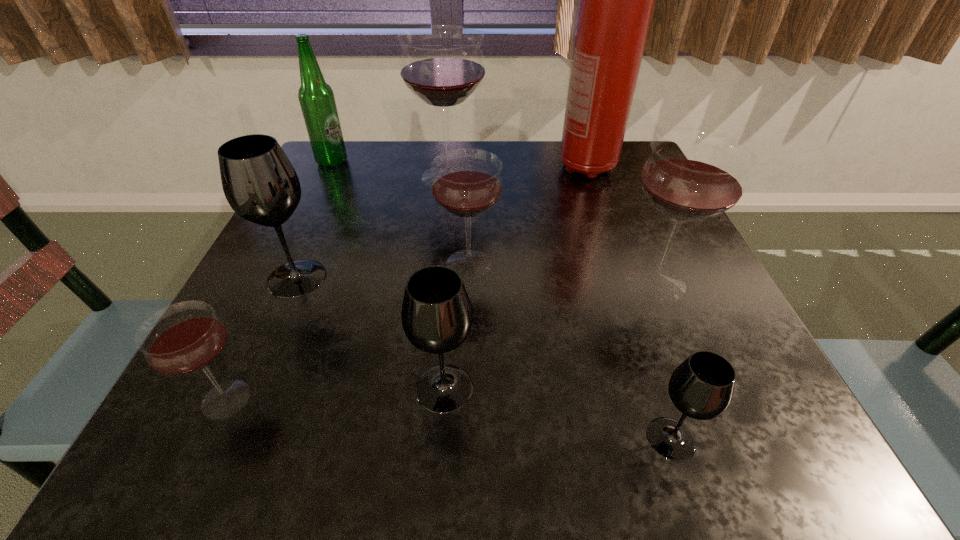
Locate an element on the screen. free area in between the smallest gray wineglass and the farthest wineglass is located at coordinates (560, 308).

This screenshot has height=540, width=960. I want to click on free spot between the nearest red wineglass and the third biggest red wineglass, so click(x=348, y=332).

Where is `empty space between the nearest red wineglass and the biggest gray wineglass`? This screenshot has width=960, height=540. empty space between the nearest red wineglass and the biggest gray wineglass is located at coordinates (261, 339).

The height and width of the screenshot is (540, 960). What are the coordinates of `free point between the green beer bottle and the biggest red wineglass` in the screenshot? It's located at (391, 169).

Find the location of a particular element. This screenshot has width=960, height=540. free space between the red fire extinguisher and the tallest wineglass is located at coordinates point(517,172).

At what (x,y) coordinates should I click in order to perform the action: click on free space between the farthest red wineglass and the farthest gray wineglass. Please return your answer as a coordinate pair (x, y). The image size is (960, 540). Looking at the image, I should click on (372, 227).

The height and width of the screenshot is (540, 960). I want to click on free spot between the second gray wineglass from left to right and the leftmost red wineglass, so click(x=335, y=394).

Where is `free spot between the rightmost red wineglass and the green beer bottle`? This screenshot has height=540, width=960. free spot between the rightmost red wineglass and the green beer bottle is located at coordinates (493, 221).

Identify which object is the fourth closest to the tallest wineglass. Please provide its 2D coordinates. Your answer should be formatted as a tuple, i.e. [(x, y)], where the tuple contains the x and y coordinates of a point satisfying the conditions above.

[(259, 182)]

I want to click on object that is the sixth closest to the rightmost red wineglass, so click(x=259, y=182).